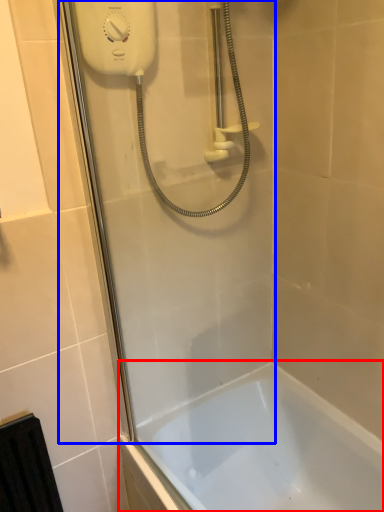
Question: Which point is further to the camera, bathtub (highlighted by a red box) or shower door (highlighted by a blue box)?

Choices:
 (A) bathtub
 (B) shower door

Answer: (A)